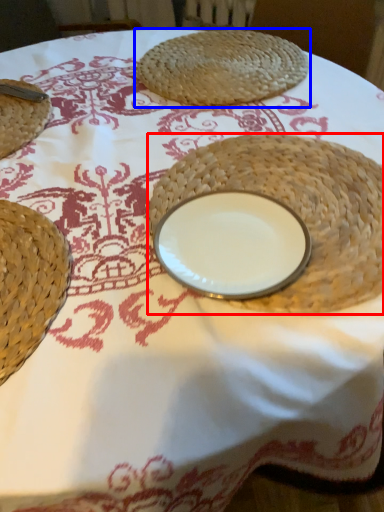
Question: Among these objects, which one is nearest to the camera, straw hat (highlighted by a red box) or food (highlighted by a blue box)?

Choices:
 (A) straw hat
 (B) food

Answer: (A)